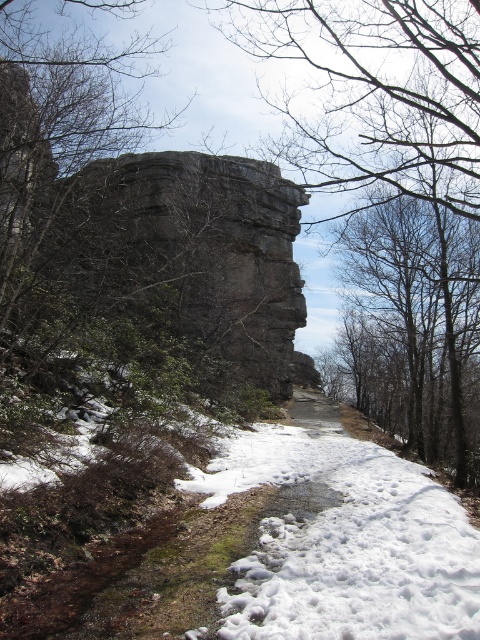
Which is below, smooth gray rock at center or white fluffy snow at center?

white fluffy snow at center is below.

Does smooth gray rock at center lie in front of white fluffy snow at center?

No, smooth gray rock at center is behind white fluffy snow at center.

Identify the location of smooth gray rock at center. The image size is (480, 640). (391, 157).